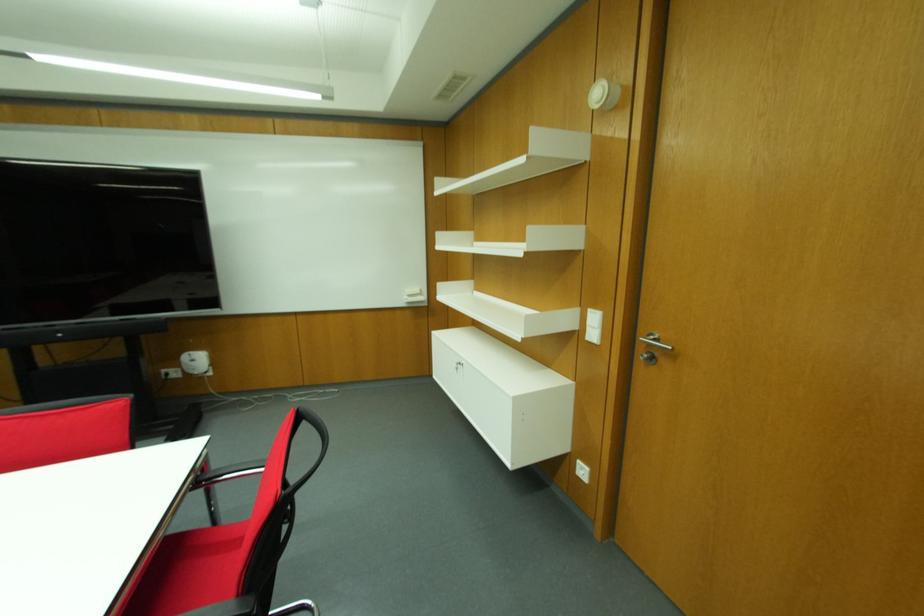
The image size is (924, 616). Find the location of `silver door handle`. silver door handle is located at coordinates (652, 346).